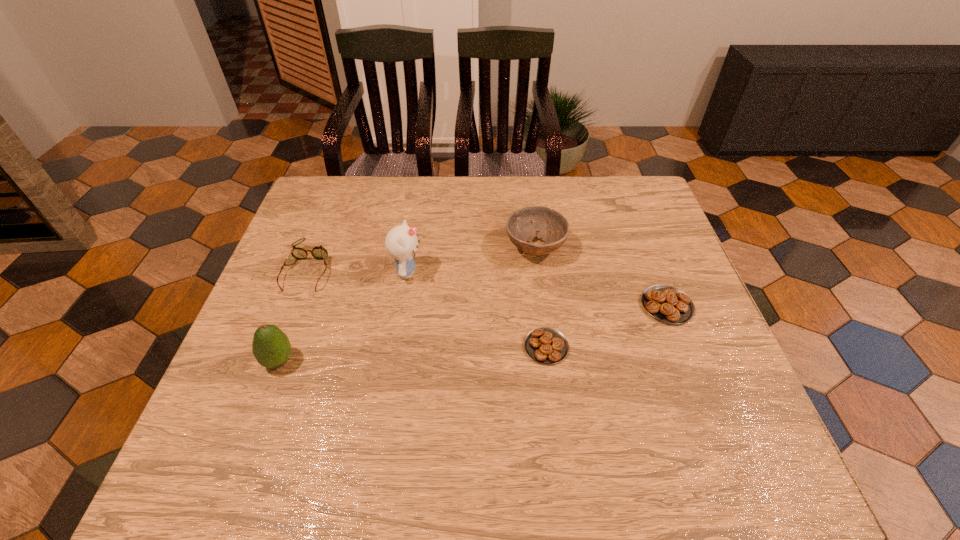
This screenshot has height=540, width=960. I want to click on vacant area that lies between the shorter pastry and the third shortest object, so click(x=427, y=308).

I want to click on free space between the right pastry and the kitten, so click(537, 288).

The image size is (960, 540). What are the coordinates of `free spot between the rightmost object and the shortest object` in the screenshot? It's located at (607, 326).

Identify the location of free spot between the shorter pastry and the bowl. (540, 297).

This screenshot has width=960, height=540. What are the coordinates of `object that is the fourth closest one to the right pastry` in the screenshot? It's located at (318, 252).

Locate an element on the screen. the second closest object to the spectacles is located at coordinates (401, 242).

Locate an element on the screen. Image resolution: width=960 pixels, height=540 pixels. free location that satisfies the following two spatial constraints: 1. on the front-facing side of the fourth tallest object; 2. on the left side of the avocado is located at coordinates pyautogui.click(x=273, y=361).

Identify the location of free location that satisfies the following two spatial constraints: 1. on the front-facing side of the left pastry; 2. on the left side of the tallest object. (395, 347).

Image resolution: width=960 pixels, height=540 pixels. What are the coordinates of `vacant space that satisfies the following two spatial constraints: 1. on the front side of the third tallest object; 2. on the left side of the second shortest object` in the screenshot? It's located at (x=542, y=306).

Find the location of `free space that satisfies the following two spatial constraints: 1. on the front side of the right pastry; 2. on the right side of the bowl`. free space that satisfies the following two spatial constraints: 1. on the front side of the right pastry; 2. on the right side of the bowl is located at coordinates (542, 306).